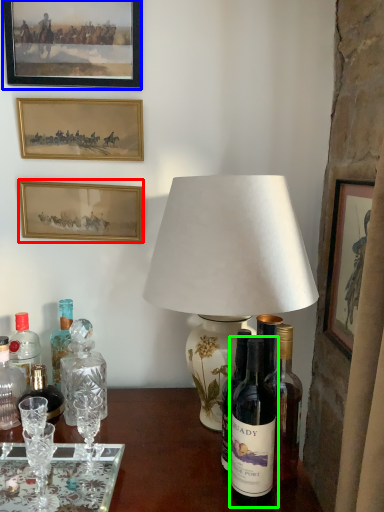
Question: Which object is positioned farthest from picture frame (highlighted by a red box)? Select from picture frame (highlighted by a blue box) and bottle (highlighted by a green box).

Choices:
 (A) picture frame
 (B) bottle

Answer: (B)